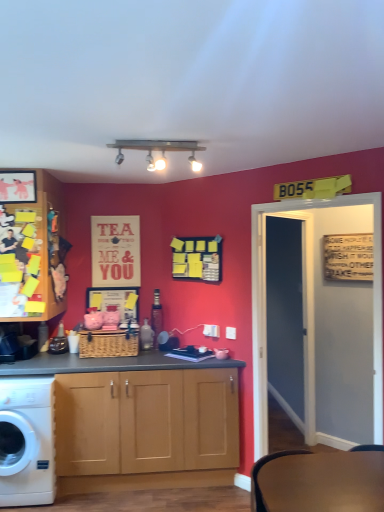
This screenshot has height=512, width=384. Describe the element at coordinates (108, 344) in the screenshot. I see `woven brown picnic basket at center` at that location.

Identify the location of matte black picture frame at upper left. point(18,186).

Locate an element on the screen. wooden cabinet at left is located at coordinates (31, 249).

The image size is (384, 512). Describe the element at coordinates (231, 333) in the screenshot. I see `white plastic power outlet at center, acting as the first power outlet starting from the right` at that location.

Measure the distance between point (x=234, y=339) and camera.

A distance of 10.31 feet exists between point (x=234, y=339) and camera.

Find the location of a particular element. This screenshot has width=384, height=512. white glossy washing machine at lower left is located at coordinates (27, 441).

Find the location of a particular element. This screenshot has width=384, height=512. white plastic power outlet at center, marked as the 2th power outlet in a front-to-back arrangement is located at coordinates (211, 330).

This screenshot has height=512, width=384. Find the location of `woven brown picnic basket at center`. woven brown picnic basket at center is located at coordinates (108, 344).

From the image's perspective, is matte paper poster at upper center positioned above or below white plastic power outlet at center, which is the 2th power outlet in right-to-left order?

matte paper poster at upper center is situated higher than white plastic power outlet at center, which is the 2th power outlet in right-to-left order, in the image.

Does matte paper poster at upper center have a smaller size compared to white plastic power outlet at center, marked as the 2th power outlet in a front-to-back arrangement?

No.

Is matte paper poster at upper center closer to camera compared to white plastic power outlet at center, the 1th power outlet viewed from the back?

No.

Does matte paper poster at upper center have a lesser width compared to white plastic power outlet at center, marked as the 2th power outlet in a front-to-back arrangement?

In fact, matte paper poster at upper center might be wider than white plastic power outlet at center, marked as the 2th power outlet in a front-to-back arrangement.

Is woven brown picnic basket at center behind matte black picture frame at upper left?

Yes, woven brown picnic basket at center is behind matte black picture frame at upper left.

Can you confirm if woven brown picnic basket at center is positioned to the left of matte black picture frame at upper left?

In fact, woven brown picnic basket at center is to the right of matte black picture frame at upper left.

I want to click on picnic basket below the matte black picture frame at upper left (from a real-world perspective), so click(x=108, y=344).

Which object is more forward, brown wooden table at lower right or matte black picture frame at upper left?

brown wooden table at lower right is closer to the camera.

Is matte black picture frame at upper left at the back of brown wooden table at lower right?

brown wooden table at lower right does not have its back to matte black picture frame at upper left.

From the image's perspective, is brown wooden table at lower right above or below matte black picture frame at upper left?

brown wooden table at lower right is situated lower than matte black picture frame at upper left in the image.

Is brown wooden table at lower right far from matte black picture frame at upper left?

That's right, there is a large distance between brown wooden table at lower right and matte black picture frame at upper left.

Is metallic track lighting at upper center a part of white plastic power outlet at center, acting as the first power outlet starting from the right?

That's incorrect, metallic track lighting at upper center is not inside white plastic power outlet at center, acting as the first power outlet starting from the right.

Is white plastic power outlet at center, arranged as the 2th power outlet when viewed from the back, next to metallic track lighting at upper center and touching it?

No, white plastic power outlet at center, arranged as the 2th power outlet when viewed from the back, is not making contact with metallic track lighting at upper center.

Considering the relative sizes of white plastic power outlet at center, arranged as the 2th power outlet when viewed from the back, and metallic track lighting at upper center in the image provided, is white plastic power outlet at center, arranged as the 2th power outlet when viewed from the back, shorter than metallic track lighting at upper center?

Correct, white plastic power outlet at center, arranged as the 2th power outlet when viewed from the back, is not as tall as metallic track lighting at upper center.

Relative to metallic track lighting at upper center, is white plastic power outlet at center, acting as the first power outlet starting from the right, in front or behind?

In the image, white plastic power outlet at center, acting as the first power outlet starting from the right, appears behind metallic track lighting at upper center.

Relative to metallic track lighting at upper center, is brown wooden table at lower right in front or behind?

brown wooden table at lower right is in front of metallic track lighting at upper center.

From the image's perspective, who appears lower, brown wooden table at lower right or metallic track lighting at upper center?

brown wooden table at lower right is shown below in the image.

What's the angular difference between brown wooden table at lower right and metallic track lighting at upper center's facing directions?

The angle between the facing direction of brown wooden table at lower right and the facing direction of metallic track lighting at upper center is 90 degrees.

How much distance is there between brown wooden table at lower right and metallic track lighting at upper center?

brown wooden table at lower right is 5.71 feet from metallic track lighting at upper center.

Is white plastic power outlet at center, arranged as the 2th power outlet when viewed from the back, looking in the opposite direction of white glossy washing machine at lower left?

No, white plastic power outlet at center, arranged as the 2th power outlet when viewed from the back, is not facing the opposite direction of white glossy washing machine at lower left.

Are white plastic power outlet at center, acting as the first power outlet starting from the right, and white glossy washing machine at lower left beside each other?

There is a gap between white plastic power outlet at center, acting as the first power outlet starting from the right, and white glossy washing machine at lower left.

Who is more distant, white plastic power outlet at center, positioned as the first power outlet in front-to-back order, or white glossy washing machine at lower left?

Positioned behind is white plastic power outlet at center, positioned as the first power outlet in front-to-back order.

From a real-world perspective, is white plastic power outlet at center, arranged as the 2th power outlet when viewed from the back, over white glossy washing machine at lower left?

Yes.

What's the angular difference between white plastic power outlet at center, marked as the 2th power outlet in a front-to-back arrangement, and matte paper poster at upper center's facing directions?

They differ by 45.2 degrees in their facing directions.

Is white plastic power outlet at center, the 1th power outlet viewed from the back, located outside matte paper poster at upper center?

Absolutely, white plastic power outlet at center, the 1th power outlet viewed from the back, is external to matte paper poster at upper center.

Consider the image. Are white plastic power outlet at center, which is the 2th power outlet in right-to-left order, and matte paper poster at upper center making contact?

white plastic power outlet at center, which is the 2th power outlet in right-to-left order, and matte paper poster at upper center are not in contact.

From their relative heights in the image, would you say white plastic power outlet at center, the 1th power outlet viewed from the back, is taller or shorter than matte paper poster at upper center?

Clearly, white plastic power outlet at center, the 1th power outlet viewed from the back, is shorter compared to matte paper poster at upper center.

Locate an element on the screen. Image resolution: width=384 pixels, height=512 pixels. poster page above the white plastic power outlet at center, which is the 2th power outlet in right-to-left order (from a real-world perspective) is located at coordinates (115, 251).

Find the location of a particular element. Image resolution: width=384 pixels, height=512 pixels. picnic basket that appears on the right of matte black picture frame at upper left is located at coordinates (108, 344).

Looking at the image, which one is located closer to woven brown picnic basket at center, matte paper poster at upper center or white plastic power outlet at center, positioned as the first power outlet in front-to-back order?

matte paper poster at upper center lies closer to woven brown picnic basket at center than the other object.

Considering their positions, is woven brown picnic basket at center positioned closer to metallic track lighting at upper center than brown wooden table at lower right?

Based on the image, woven brown picnic basket at center appears to be nearer to metallic track lighting at upper center.

From the image, which object appears to be farther from white glossy washing machine at lower left, metallic track lighting at upper center or woven brown picnic basket at center?

metallic track lighting at upper center lies further to white glossy washing machine at lower left than the other object.

When comparing their distances from white glossy washing machine at lower left, does metallic track lighting at upper center or brown wooden table at lower right seem further?

The object further to white glossy washing machine at lower left is metallic track lighting at upper center.

Estimate the real-world distances between objects in this image. Which object is further from matte paper poster at upper center, metallic track lighting at upper center or matte black picture frame at upper left?

The object further to matte paper poster at upper center is metallic track lighting at upper center.

Which object lies further to the anchor point metallic track lighting at upper center, woven brown picnic basket at center or wooden cabinet at left?

woven brown picnic basket at center.

Which object lies further to the anchor point matte black picture frame at upper left, wooden cabinet at left or white glossy washing machine at lower left?

white glossy washing machine at lower left.

In the scene shown: Which object lies further to the anchor point brown wooden table at lower right, white plastic power outlet at center, acting as the first power outlet starting from the right, or white plastic power outlet at center, marked as the 2th power outlet in a front-to-back arrangement?

white plastic power outlet at center, marked as the 2th power outlet in a front-to-back arrangement.

This screenshot has height=512, width=384. Find the location of `picture frame between brown wooden table at lower right and matte paper poster at upper center in the front-back direction`. picture frame between brown wooden table at lower right and matte paper poster at upper center in the front-back direction is located at coordinates pyautogui.click(x=18, y=186).

Identify the location of picnic basket situated between matte black picture frame at upper left and brown wooden table at lower right from left to right. The width and height of the screenshot is (384, 512). [x=108, y=344].

This screenshot has height=512, width=384. In order to click on picnic basket between wooden cabinet at left and white plastic power outlet at center, which is the 2th power outlet in left-to-right order, in the horizontal direction in this screenshot , I will do `click(108, 344)`.

Image resolution: width=384 pixels, height=512 pixels. Find the location of `cabinetry between matte black picture frame at upper left and metallic track lighting at upper center`. cabinetry between matte black picture frame at upper left and metallic track lighting at upper center is located at coordinates (31, 249).